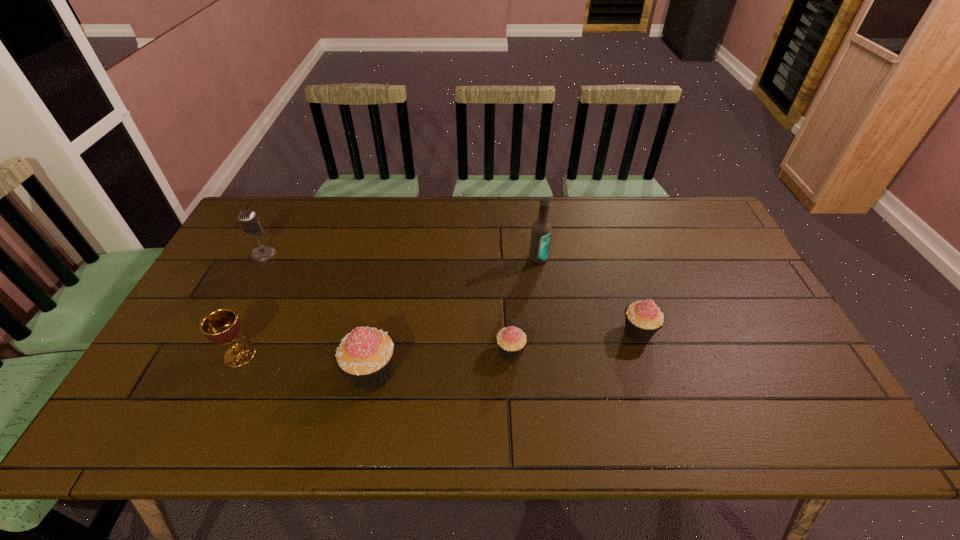
Identify the location of the third object from left to right. (365, 356).

Where is `the tallest cupcake`? This screenshot has height=540, width=960. the tallest cupcake is located at coordinates (365, 356).

Where is `the second cupcake from left to right`? This screenshot has height=540, width=960. the second cupcake from left to right is located at coordinates (511, 341).

Locate an element on the screen. the shortest object is located at coordinates (511, 341).

The image size is (960, 540). Identify the location of the second tallest cupcake. (643, 319).

Find the location of a particular element. The width and height of the screenshot is (960, 540). the rightmost cupcake is located at coordinates (643, 319).

The height and width of the screenshot is (540, 960). What are the coordinates of `chalice` in the screenshot? It's located at (222, 326).

You are a GUI agent. You are given a task and a screenshot of the screen. Output one action in this format:
    pyautogui.click(x=<x>, y=<y>)
    Task: Click on the microphone
    The height and width of the screenshot is (540, 960).
    Given the screenshot: What is the action you would take?
    pyautogui.click(x=250, y=224)

Find the location of a particular element. This screenshot has height=540, width=960. beer bottle is located at coordinates (541, 230).

This screenshot has width=960, height=540. Find the location of `the tallest object`. the tallest object is located at coordinates (541, 230).